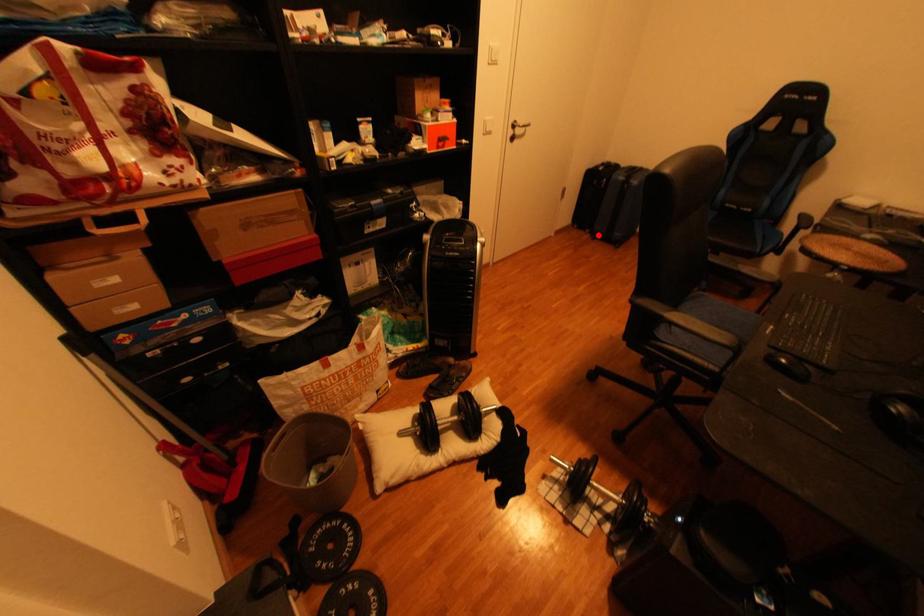
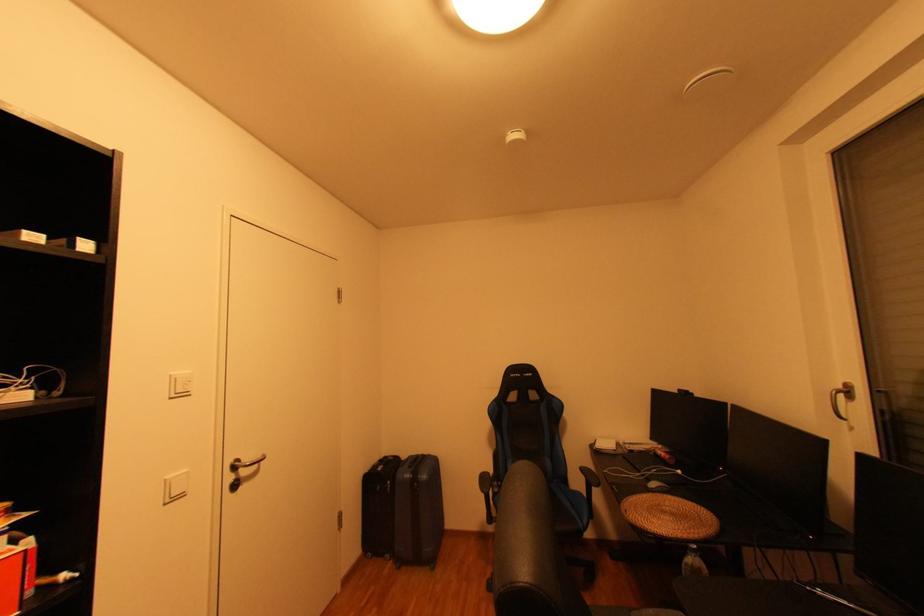
Find the pixel in the second image that matches the highlighted location in the first image.

(400, 562)